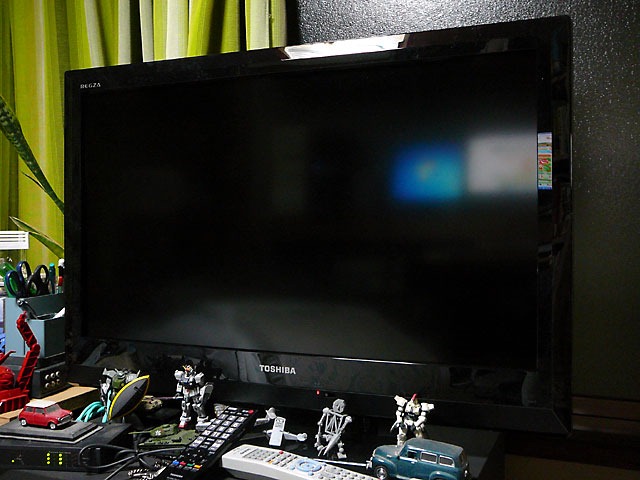
You are a GUI agent. You are given a task and a screenshot of the screen. Output one action in this format:
    pyautogui.click(x=<x>, y=<y>)
    Task: Click on the curtain
    Image resolution: width=640 pixels, height=480 pixels.
    Given the screenshot: What is the action you would take?
    pyautogui.click(x=266, y=25), pyautogui.click(x=169, y=28), pyautogui.click(x=88, y=40), pyautogui.click(x=45, y=46), pyautogui.click(x=38, y=124), pyautogui.click(x=36, y=201)